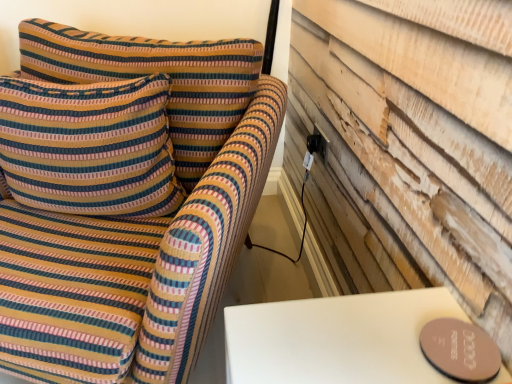
Question: Is striped fabric pillow at left at the right side of striped fabric sofa at left?

Choices:
 (A) no
 (B) yes

Answer: (A)

Question: Considering the relative sizes of striped fabric pillow at left and striped fabric sofa at left in the image provided, is striped fabric pillow at left thinner than striped fabric sofa at left?

Choices:
 (A) no
 (B) yes

Answer: (B)

Question: From a real-world perspective, is striped fabric pillow at left over striped fabric sofa at left?

Choices:
 (A) yes
 (B) no

Answer: (A)

Question: Could you tell me if striped fabric pillow at left is facing striped fabric sofa at left?

Choices:
 (A) no
 (B) yes

Answer: (B)

Question: Is striped fabric pillow at left outside of striped fabric sofa at left?

Choices:
 (A) no
 (B) yes

Answer: (A)

Question: Is striped fabric pillow at left in front of striped fabric sofa at left?

Choices:
 (A) no
 (B) yes

Answer: (A)

Question: Is striped fabric sofa at left behind striped fabric pillow at left?

Choices:
 (A) no
 (B) yes

Answer: (A)

Question: Could you tell me if striped fabric sofa at left is facing striped fabric pillow at left?

Choices:
 (A) yes
 (B) no

Answer: (A)

Question: Can we say striped fabric sofa at left lies outside striped fabric pillow at left?

Choices:
 (A) no
 (B) yes

Answer: (B)

Question: Is striped fabric sofa at left at the left side of striped fabric pillow at left?

Choices:
 (A) no
 (B) yes

Answer: (A)

Question: Is striped fabric sofa at left surrounding striped fabric pillow at left?

Choices:
 (A) no
 (B) yes

Answer: (B)

Question: Is striped fabric sofa at left positioned in front of striped fabric pillow at left?

Choices:
 (A) no
 (B) yes

Answer: (B)

Question: In terms of size, does striped fabric sofa at left appear bigger or smaller than striped fabric pillow at left?

Choices:
 (A) big
 (B) small

Answer: (A)